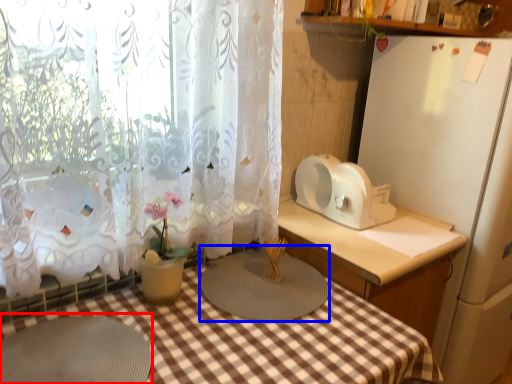
Question: Which object is further to the camera taking this photo, round table (highlighted by a red box) or appliance (highlighted by a blue box)?

Choices:
 (A) round table
 (B) appliance

Answer: (B)